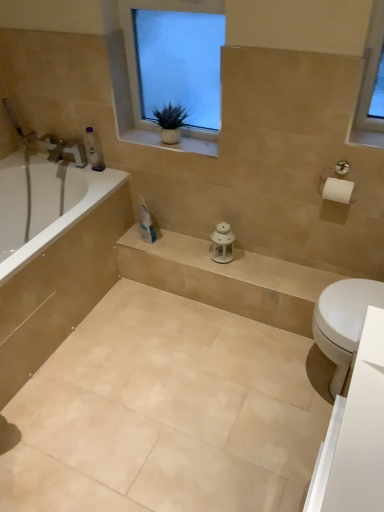
I want to click on blank space above green matte plant at upper center (from a real-world perspective), so click(x=180, y=92).